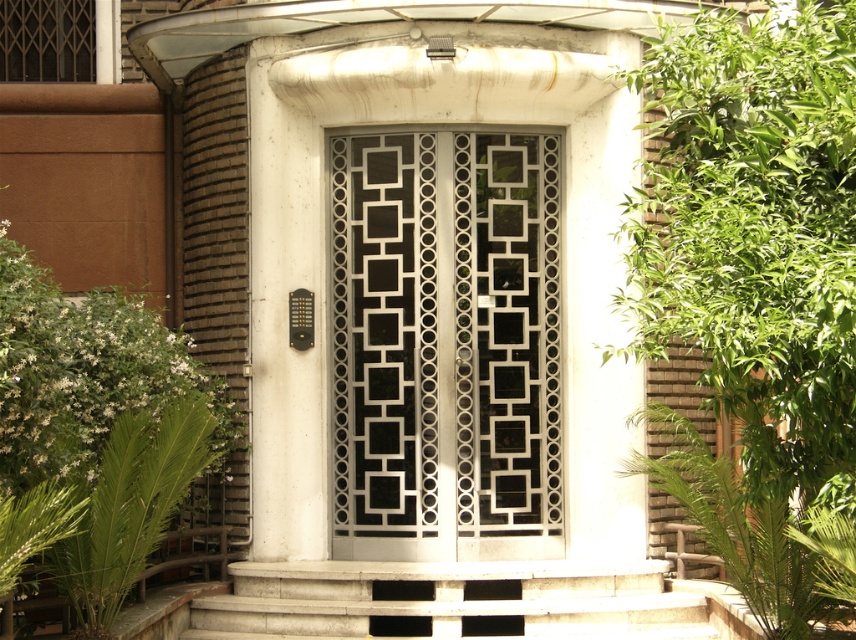
Question: Which of the following is the closest to the observer?

Choices:
 (A) white concrete stairs at center
 (B) green leafy plant at lower right

Answer: (B)

Question: Which point appears farthest from the camera in this image?

Choices:
 (A) (522, 378)
 (B) (572, 572)

Answer: (A)

Question: Observing the image, what is the correct spatial positioning of black metal door at center in reference to white concrete stairs at center?

Choices:
 (A) right
 (B) left

Answer: (B)

Question: Estimate the real-world distances between objects in this image. Which object is farther from the green leafy plant at lower right?

Choices:
 (A) white concrete stairs at center
 (B) green leafy plant at lower left

Answer: (B)

Question: Does green leafy plant at right appear on the right side of white concrete stairs at center?

Choices:
 (A) yes
 (B) no

Answer: (A)

Question: Does green leafy plant at lower left have a larger size compared to white concrete stairs at center?

Choices:
 (A) yes
 (B) no

Answer: (A)